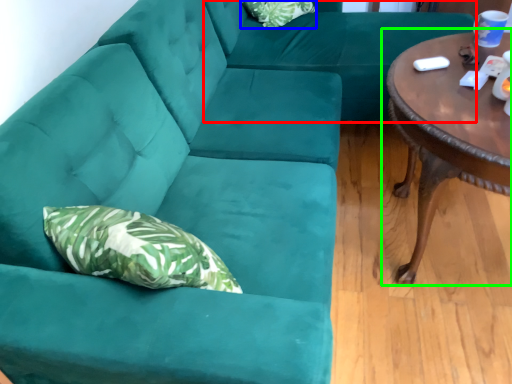
Question: Which is nearer to the couch (highlighted by a red box)? pillow (highlighted by a blue box) or coffee table (highlighted by a green box).

Choices:
 (A) pillow
 (B) coffee table

Answer: (A)